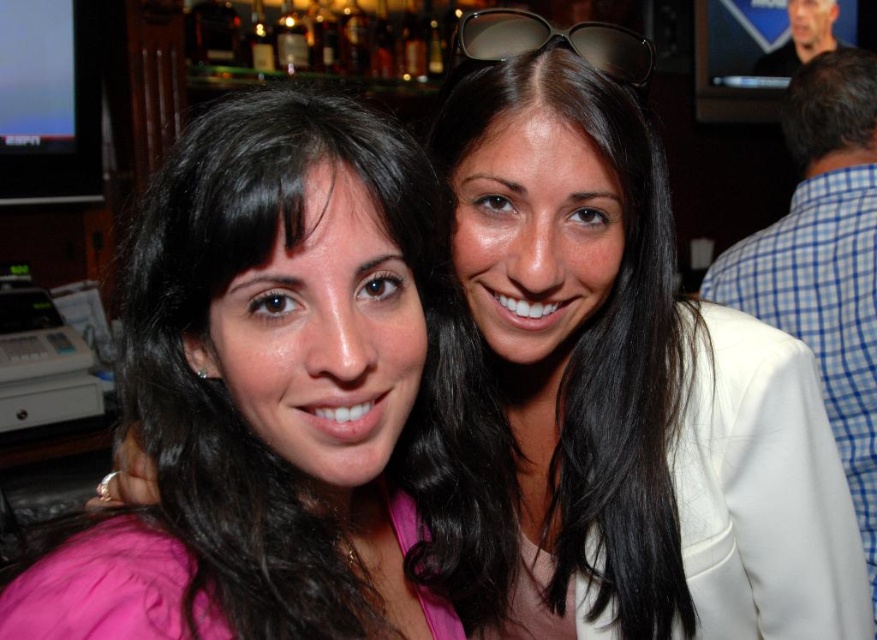
Can you confirm if pink fabric at center is positioned to the right of brown reflective sunglasses at upper center?

No, pink fabric at center is not to the right of brown reflective sunglasses at upper center.

Is point (398, 372) positioned after point (619, 48)?

No, (398, 372) is in front of (619, 48).

I want to click on pink fabric at center, so click(269, 388).

Where is `pink fabric at center`? pink fabric at center is located at coordinates (269, 388).

Does smooth black hair at center have a smaller size compared to brown reflective sunglasses at upper center?

No.

Is smooth black hair at center further to camera compared to brown reflective sunglasses at upper center?

No.

Does point (654, 410) come closer to viewer compared to point (505, 20)?

No.

Locate an element on the screen. smooth black hair at center is located at coordinates (603, 344).

Can you confirm if pink fabric at center is shorter than white fabric jacket at right?

Yes, pink fabric at center is shorter than white fabric jacket at right.

Who is more forward, (351, 118) or (838, 168)?

Positioned in front is point (351, 118).

Is point (33, 630) more distant than point (793, 253)?

No, (33, 630) is closer to viewer.

You are a GUI agent. You are given a task and a screenshot of the screen. Output one action in this format:
    pyautogui.click(x=<x>, y=<y>)
    Task: Click on the pink fabric at center
    This screenshot has height=640, width=877.
    Given the screenshot: What is the action you would take?
    pyautogui.click(x=269, y=388)